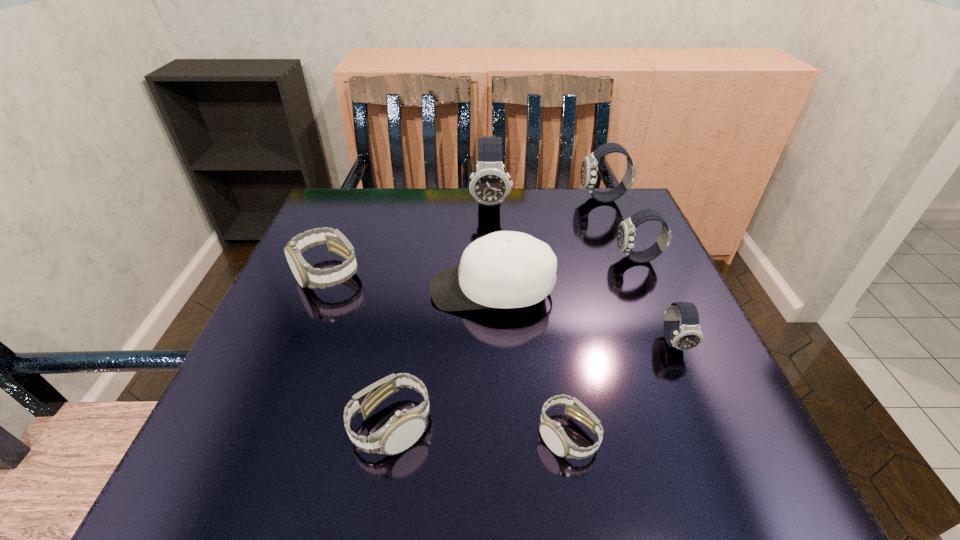
Locate an element on the screen. Image resolution: width=960 pixels, height=540 pixels. vacant space situated on the face of the third biggest dark watch is located at coordinates (468, 259).

Locate an element on the screen. This screenshot has height=540, width=960. vacant space located on the face of the third biggest dark watch is located at coordinates (476, 259).

This screenshot has width=960, height=540. I want to click on vacant space located 0.060m on the face of the third biggest dark watch, so click(x=588, y=259).

Identify the location of free spot located 0.130m on the face of the biggest white watch. This screenshot has height=540, width=960. (298, 347).

This screenshot has height=540, width=960. Find the location of `vacant area located on the face of the sixth farthest object`. vacant area located on the face of the sixth farthest object is located at coordinates (710, 427).

Where is `vacant area situated 0.380m on the face of the second biggest white watch`? vacant area situated 0.380m on the face of the second biggest white watch is located at coordinates (678, 426).

Image resolution: width=960 pixels, height=540 pixels. I want to click on object present at the left edge, so 959,0.

Locate an element on the screen. object present at the far right corner is located at coordinates (959, 0).

At what (x,y) coordinates should I click in order to perform the action: click on object that ranks as the sixth closest to the third farthest dark watch. Please return your answer as a coordinate pair (x, y). The height and width of the screenshot is (540, 960). Looking at the image, I should click on (959, 0).

Identify which object is the seventh closest to the second smallest white watch. Please provide its 2D coordinates. Your answer should be formatted as a tuple, i.e. [(x, y)], where the tuple contains the x and y coordinates of a point satisfying the conditions above.

[(959, 0)]